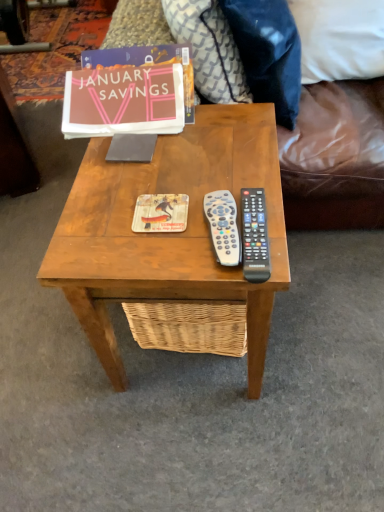
Image resolution: width=384 pixels, height=512 pixels. Describe the element at coordinates (169, 233) in the screenshot. I see `wooden coffee table at center` at that location.

You are a GUI agent. You are given a task and a screenshot of the screen. Output one action in this format:
    pyautogui.click(x=<x>, y=<y>)
    Task: Click on the velvety dark blue pillow at upper right, which is counted as the second pillow, starting from the left
    Image resolution: width=384 pixels, height=512 pixels.
    Given the screenshot: What is the action you would take?
    pyautogui.click(x=268, y=53)

Identify the location of matte paper book at upper center. (130, 92).

The width and height of the screenshot is (384, 512). Find the location of `patterned fabric pillow at upper center, which ranks as the third pillow in right-to-left order`. patterned fabric pillow at upper center, which ranks as the third pillow in right-to-left order is located at coordinates (209, 49).

How much space does patterned fabric pillow at upper center, which ranks as the third pillow in right-to-left order, occupy vertically?

patterned fabric pillow at upper center, which ranks as the third pillow in right-to-left order, is 16.52 inches in height.

What do you see at coordinates (160, 213) in the screenshot? Image resolution: width=384 pixels, height=512 pixels. I see `matte paper book cover at center` at bounding box center [160, 213].

You are a GUI agent. You are given a task and a screenshot of the screen. Output one action in this format:
    pyautogui.click(x=<x>, y=<y>)
    Task: Click on the brown fabric couch at upper center
    The image size is (384, 512).
    Given the screenshot: What is the action you would take?
    pyautogui.click(x=335, y=157)

Where is `wooden coffee table at center`? The height and width of the screenshot is (512, 384). wooden coffee table at center is located at coordinates click(x=169, y=233).

From a real-world perspective, which object rests below the other?

white plastic remote at center, positioned as the first remote control in left-to-right order.

Which is in front, point (185, 120) or point (218, 197)?

Point (218, 197)

Can you confirm if matte paper book at upper center is taller than white plastic remote at center, arranged as the 2th remote control when viewed from the right?

Correct, matte paper book at upper center is much taller as white plastic remote at center, arranged as the 2th remote control when viewed from the right.

Considering the relative sizes of matte paper book at upper center and white plastic remote at center, arranged as the 2th remote control when viewed from the right, in the image provided, is matte paper book at upper center thinner than white plastic remote at center, arranged as the 2th remote control when viewed from the right,?

No.

Between brown fabric couch at upper center and white plastic remote at center, positioned as the first remote control in left-to-right order, which one has larger width?

With larger width is brown fabric couch at upper center.

Is brown fabric couch at upper center surrounding white plastic remote at center, arranged as the 2th remote control when viewed from the right?

No, brown fabric couch at upper center does not contain white plastic remote at center, arranged as the 2th remote control when viewed from the right.

Is the position of brown fabric couch at upper center more distant than that of white plastic remote at center, arranged as the 2th remote control when viewed from the right?

Yes, the depth of brown fabric couch at upper center is greater than that of white plastic remote at center, arranged as the 2th remote control when viewed from the right.

Considering the positions of objects brown fabric couch at upper center and white plastic remote at center, arranged as the 2th remote control when viewed from the right, in the image provided, who is more to the left, brown fabric couch at upper center or white plastic remote at center, arranged as the 2th remote control when viewed from the right,?

white plastic remote at center, arranged as the 2th remote control when viewed from the right.

Could you measure the distance between patterned fabric pillow at upper center, which is the 1th pillow in left-to-right order, and white plastic remote at center, arranged as the 2th remote control when viewed from the right?

patterned fabric pillow at upper center, which is the 1th pillow in left-to-right order, and white plastic remote at center, arranged as the 2th remote control when viewed from the right, are 21.45 inches apart from each other.

From a real-world perspective, is patterned fabric pillow at upper center, which ranks as the third pillow in right-to-left order, on top of white plastic remote at center, positioned as the first remote control in left-to-right order?

Actually, patterned fabric pillow at upper center, which ranks as the third pillow in right-to-left order, is physically below white plastic remote at center, positioned as the first remote control in left-to-right order, in the real world.

From the image's perspective, would you say patterned fabric pillow at upper center, which is the 1th pillow in left-to-right order, is shown under white plastic remote at center, positioned as the first remote control in left-to-right order?

No, from the image's perspective, patterned fabric pillow at upper center, which is the 1th pillow in left-to-right order, is not beneath white plastic remote at center, positioned as the first remote control in left-to-right order.

Is patterned fabric pillow at upper center, which is the 1th pillow in left-to-right order, shorter than white plastic remote at center, positioned as the first remote control in left-to-right order?

No.

Which of these two, patterned fabric pillow at upper center, which is the 1th pillow in left-to-right order, or black plastic remote at center right, arranged as the first remote control when viewed from the right, is wider?

black plastic remote at center right, arranged as the first remote control when viewed from the right.

Is patterned fabric pillow at upper center, which is the 1th pillow in left-to-right order, situated inside black plastic remote at center right, arranged as the first remote control when viewed from the right, or outside?

The correct answer is: outside.

Based on the photo, considering the sizes of objects patterned fabric pillow at upper center, which ranks as the third pillow in right-to-left order, and black plastic remote at center right, placed as the second remote control when sorted from left to right, in the image provided, who is smaller, patterned fabric pillow at upper center, which ranks as the third pillow in right-to-left order, or black plastic remote at center right, placed as the second remote control when sorted from left to right,?

Smaller between the two is black plastic remote at center right, placed as the second remote control when sorted from left to right.

Considering the relative positions of patterned fabric pillow at upper center, which ranks as the third pillow in right-to-left order, and black plastic remote at center right, arranged as the first remote control when viewed from the right, in the image provided, is patterned fabric pillow at upper center, which ranks as the third pillow in right-to-left order, to the right of black plastic remote at center right, arranged as the first remote control when viewed from the right, from the viewer's perspective?

No.

Does wooden coffee table at center turn towards matte paper book cover at center?

No, wooden coffee table at center is not facing towards matte paper book cover at center.

Are wooden coffee table at center and matte paper book cover at center making contact?

No, wooden coffee table at center is not in contact with matte paper book cover at center.

Is the position of wooden coffee table at center more distant than that of matte paper book cover at center?

No.

Is patterned fabric pillow at upper center, which ranks as the third pillow in right-to-left order, facing away from wooden coffee table at center?

patterned fabric pillow at upper center, which ranks as the third pillow in right-to-left order, does not have its back to wooden coffee table at center.

From the picture: Can you confirm if patterned fabric pillow at upper center, which is the 1th pillow in left-to-right order, is bigger than wooden coffee table at center?

Actually, patterned fabric pillow at upper center, which is the 1th pillow in left-to-right order, might be smaller than wooden coffee table at center.

I want to click on the 1st pillow counting from the right side of the wooden coffee table at center, so click(209, 49).

Is there a large distance between patterned fabric pillow at upper center, which is the 1th pillow in left-to-right order, and wooden coffee table at center?

No.

Considering the relative sizes of white fabric pillow at upper right, which ranks as the third pillow in left-to-right order, and matte paper book cover at center in the image provided, is white fabric pillow at upper right, which ranks as the third pillow in left-to-right order, thinner than matte paper book cover at center?

Incorrect, the width of white fabric pillow at upper right, which ranks as the third pillow in left-to-right order, is not less than that of matte paper book cover at center.

From a real-world perspective, who is located lower, white fabric pillow at upper right, which ranks as the third pillow in left-to-right order, or matte paper book cover at center?

white fabric pillow at upper right, which ranks as the third pillow in left-to-right order.

Could matte paper book cover at center be considered to be inside white fabric pillow at upper right, which ranks as the third pillow in left-to-right order?

Definitely not — matte paper book cover at center is not inside white fabric pillow at upper right, which ranks as the third pillow in left-to-right order.

From a real-world perspective, starting from the matte paper book at upper center, which remote control is the 1st one below it? Please provide its 2D coordinates.

[(223, 226)]

Where is `the 1st remote control positioned below the brown fabric couch at upper center (from the image's perspective)`? the 1st remote control positioned below the brown fabric couch at upper center (from the image's perspective) is located at coordinates (223, 226).

Which object lies nearer to the anchor point white fabric pillow at upper right, which ranks as the third pillow in left-to-right order, patterned fabric pillow at upper center, which ranks as the third pillow in right-to-left order, or black plastic remote at center right, placed as the second remote control when sorted from left to right?

patterned fabric pillow at upper center, which ranks as the third pillow in right-to-left order.

Estimate the real-world distances between objects in this image. Which object is further from white plastic remote at center, arranged as the 2th remote control when viewed from the right, patterned fabric pillow at upper center, which is the 1th pillow in left-to-right order, or white fabric pillow at upper right, which is the 1th pillow from right to left?

white fabric pillow at upper right, which is the 1th pillow from right to left, lies further to white plastic remote at center, arranged as the 2th remote control when viewed from the right, than the other object.

Looking at the image, which one is located closer to wooden coffee table at center, white fabric pillow at upper right, which is the 1th pillow from right to left, or matte paper book cover at center?

Based on the image, matte paper book cover at center appears to be nearer to wooden coffee table at center.

Which object lies nearer to the anchor point matte paper book cover at center, patterned fabric pillow at upper center, which is the 1th pillow in left-to-right order, or brown fabric couch at upper center?

Based on the image, patterned fabric pillow at upper center, which is the 1th pillow in left-to-right order, appears to be nearer to matte paper book cover at center.

Estimate the real-world distances between objects in this image. Which object is further from velvety dark blue pillow at upper right, which is counted as the second pillow, starting from the left, matte paper book cover at center or white fabric pillow at upper right, which is the 1th pillow from right to left?

matte paper book cover at center lies further to velvety dark blue pillow at upper right, which is counted as the second pillow, starting from the left, than the other object.

Considering their positions, is white fabric pillow at upper right, which ranks as the third pillow in left-to-right order, positioned closer to white plastic remote at center, arranged as the 2th remote control when viewed from the right, than brown fabric couch at upper center?

white fabric pillow at upper right, which ranks as the third pillow in left-to-right order.

Estimate the real-world distances between objects in this image. Which object is further from matte paper book at upper center, white plastic remote at center, arranged as the 2th remote control when viewed from the right, or black plastic remote at center right, arranged as the first remote control when viewed from the right?

Based on the image, black plastic remote at center right, arranged as the first remote control when viewed from the right, appears to be further to matte paper book at upper center.

In the scene shown: From the image, which object appears to be farther from brown fabric couch at upper center, wooden coffee table at center or white plastic remote at center, arranged as the 2th remote control when viewed from the right?

white plastic remote at center, arranged as the 2th remote control when viewed from the right, lies further to brown fabric couch at upper center than the other object.

You are a GUI agent. You are given a task and a screenshot of the screen. Output one action in this format:
    pyautogui.click(x=<x>, y=<y>)
    Task: Click on the remote control that lies between patterned fabric pillow at upper center, which ranks as the third pillow in right-to-left order, and black plastic remote at center right, arranged as the first remote control when viewed from the right, from top to bottom
    
    Given the screenshot: What is the action you would take?
    pyautogui.click(x=223, y=226)

Where is `pillow between patterned fabric pillow at upper center, which is the 1th pillow in left-to-right order, and white plastic remote at center, positioned as the first remote control in left-to-right order, vertically`? pillow between patterned fabric pillow at upper center, which is the 1th pillow in left-to-right order, and white plastic remote at center, positioned as the first remote control in left-to-right order, vertically is located at coordinates (268, 53).

The width and height of the screenshot is (384, 512). Find the location of `paperback book between velvety dark blue pillow at upper right, which is counted as the second pillow, starting from the left, and wooden coffee table at center from top to bottom`. paperback book between velvety dark blue pillow at upper right, which is counted as the second pillow, starting from the left, and wooden coffee table at center from top to bottom is located at coordinates (130, 92).

Identify the location of book cover between white fabric pillow at upper right, which is the 1th pillow from right to left, and wooden coffee table at center in the up-down direction. This screenshot has width=384, height=512. (160, 213).